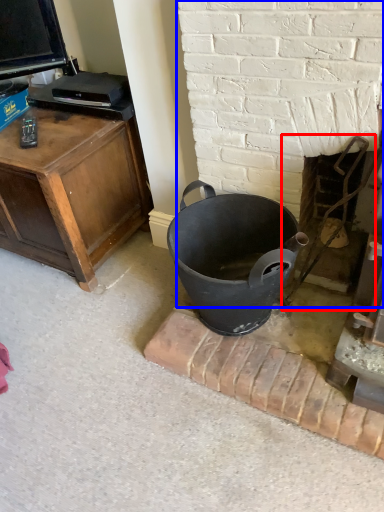
Question: Which object is further to the camera taking this photo, fireplace (highlighted by a red box) or fireplace (highlighted by a blue box)?

Choices:
 (A) fireplace
 (B) fireplace

Answer: (A)